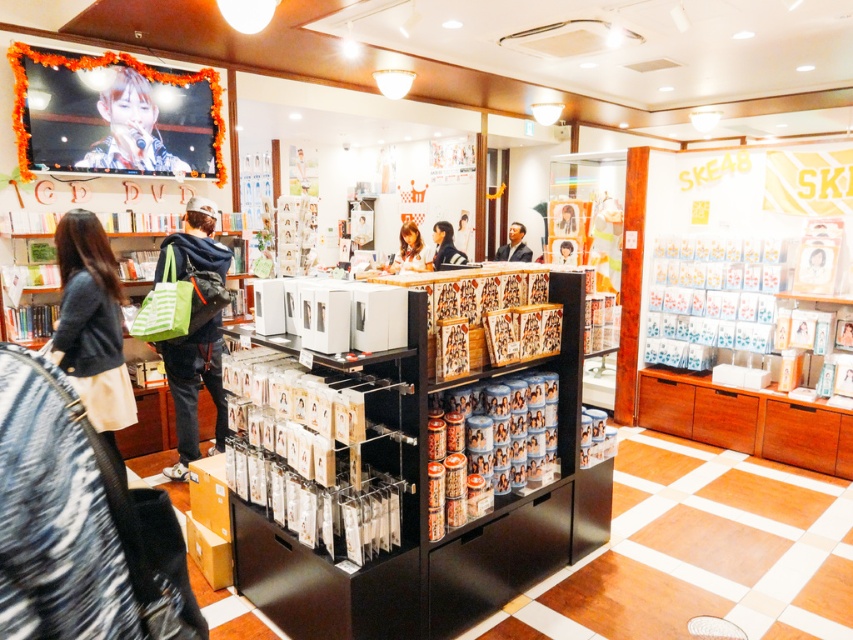
Question: Which point appears farthest from the camera in this image?

Choices:
 (A) pos(181,243)
 (B) pos(566,227)

Answer: (B)

Question: Is dark gray sweater at lower left bigger than dark blue suit at center?

Choices:
 (A) yes
 (B) no

Answer: (A)

Question: Which point is closer to the camera?

Choices:
 (A) (573, 220)
 (B) (509, 236)
 (C) (405, 228)

Answer: (A)

Question: Is dark gray sweater at lower left positioned before green striped tote bag at center?

Choices:
 (A) yes
 (B) no

Answer: (A)

Question: Which point is farther to the camera?

Choices:
 (A) smooth brown hair at center
 (B) smooth white blouse at center
 (C) matte black jacket at center

Answer: (A)

Question: Can you confirm if green striped tote bag at center is positioned above matte black microphone at upper left?

Choices:
 (A) yes
 (B) no

Answer: (B)